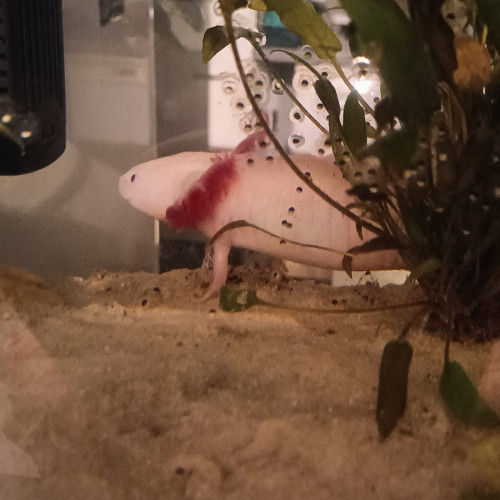
Where is `plant`? This screenshot has width=500, height=500. plant is located at coordinates (462, 252).